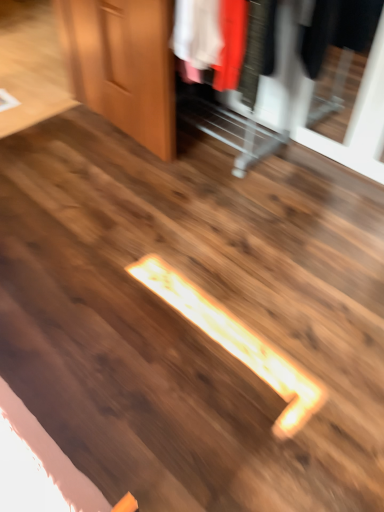
At what (x,y) coordinates should I click in order to perform the action: click on vacant region below wooden door at upper left (from a real-world perspective). Please return your answer as a coordinate pair (x, y). This screenshot has width=384, height=512. Looking at the image, I should click on (117, 128).